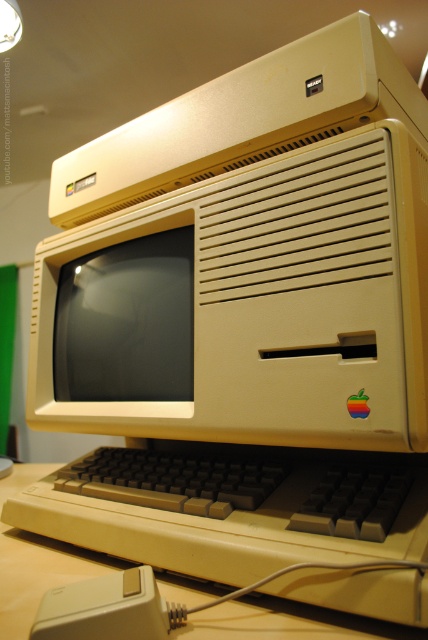
Question: Which object is farther from the camera taking this photo?

Choices:
 (A) white plastic mouse at lower left
 (B) beige plastic keyboard at center

Answer: (B)

Question: Is matte plastic monitor at center to the left of beige plastic keyboard at center from the viewer's perspective?

Choices:
 (A) yes
 (B) no

Answer: (B)

Question: Which point is closer to the camera taking this photo?

Choices:
 (A) (247, 604)
 (B) (115, 600)

Answer: (B)

Question: Which object is positioned farthest from the beige plastic keyboard at center?

Choices:
 (A) matte plastic monitor at center
 (B) white plastic mouse at lower left

Answer: (A)

Question: Does beige plastic keyboard at center appear under white plastic mouse at lower left?

Choices:
 (A) no
 (B) yes

Answer: (B)

Question: Does beige plastic keyboard at center appear over white plastic mouse at lower left?

Choices:
 (A) yes
 (B) no

Answer: (B)